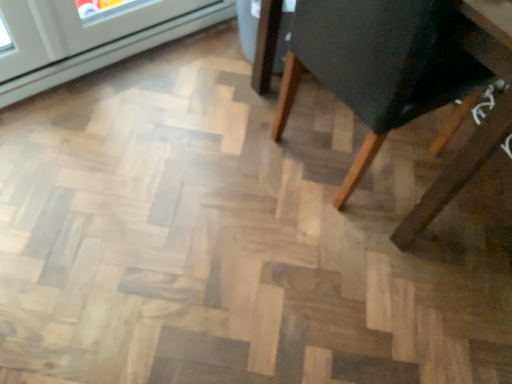
What are the coordinates of `vacant area that is in front of black matte chair at upper right` in the screenshot? It's located at (342, 262).